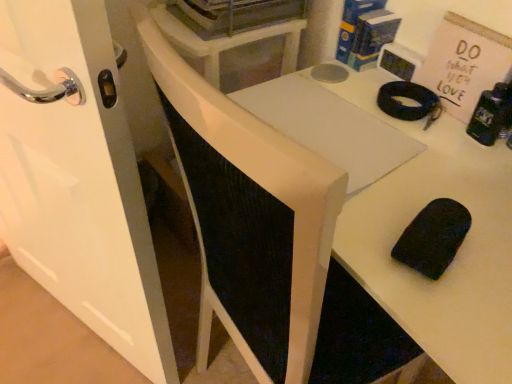
Find the location of a particular element. vacant space situated on the left part of matte black clock at upper right, which appears as the second appliance when viewed from the top is located at coordinates (346, 83).